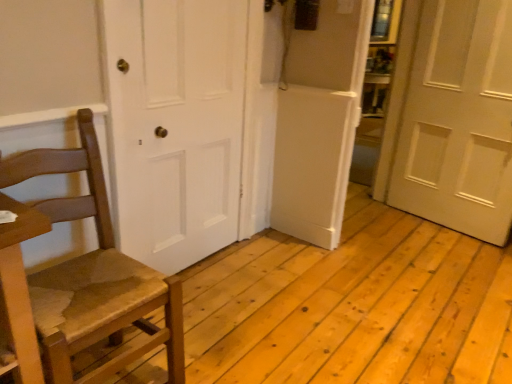
Locate an element on the screen. free space to the left of white matte door at right, the second door in the left-to-right sequence is located at coordinates (395, 230).